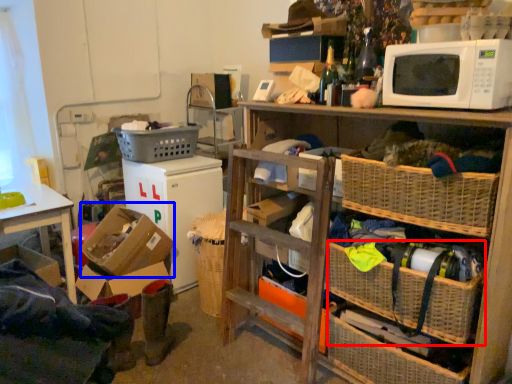
Question: Which of the following is the closest to the observer, basket (highlighted by a red box) or box (highlighted by a blue box)?

Choices:
 (A) basket
 (B) box

Answer: (A)